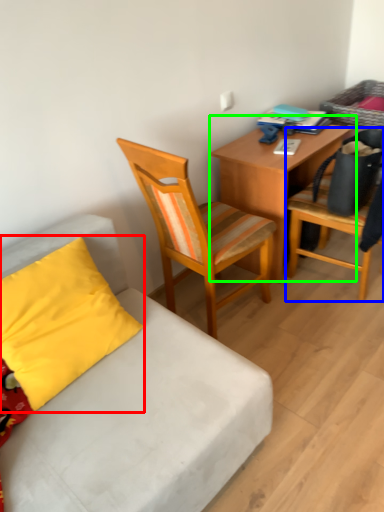
Question: Which is farther away from pillow (highlighted by a red box)? chair (highlighted by a blue box) or desk (highlighted by a green box)?

Choices:
 (A) chair
 (B) desk

Answer: (A)